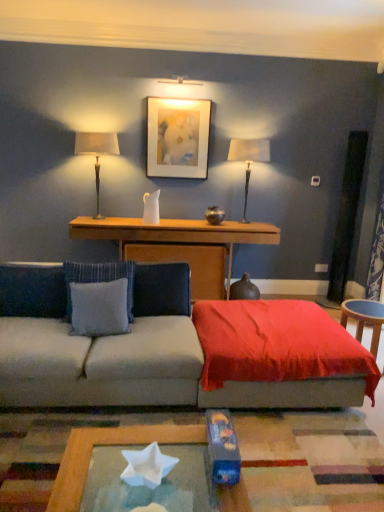
Question: Based on their sizes in the image, would you say matte white picture frame at upper center is bigger or smaller than velvet red throw at center?

Choices:
 (A) big
 (B) small

Answer: (B)

Question: Considering the positions of point (170, 112) and point (286, 335), is point (170, 112) closer or farther from the camera than point (286, 335)?

Choices:
 (A) farther
 (B) closer

Answer: (A)

Question: Considering the real-world distances, which object is closest to the matte white picture frame at upper center?

Choices:
 (A) blue fabric pillow at center, which is the 1th pillow from right to left
 (B) blue fabric pillow at left, acting as the 3th pillow starting from the right
 (C) gray fabric pillow at center, the second pillow viewed from the right
 (D) satin beige lampshade at left, marked as the 2th table lamp in a right-to-left arrangement
 (E) wooden console at center, which ranks as the second table in front-to-back order

Answer: (D)

Question: Which object is positioned farthest from the blue fabric pillow at center, the 3th pillow in the left-to-right sequence?

Choices:
 (A) matte white picture frame at upper center
 (B) wooden console at center, the first table when ordered from back to front
 (C) gray fabric pillow at center, the second pillow viewed from the right
 (D) satin beige lampshade at left, which is counted as the 1th table lamp, starting from the left
 (E) matte white lampshade at right, positioned as the second table lamp in left-to-right order

Answer: (E)